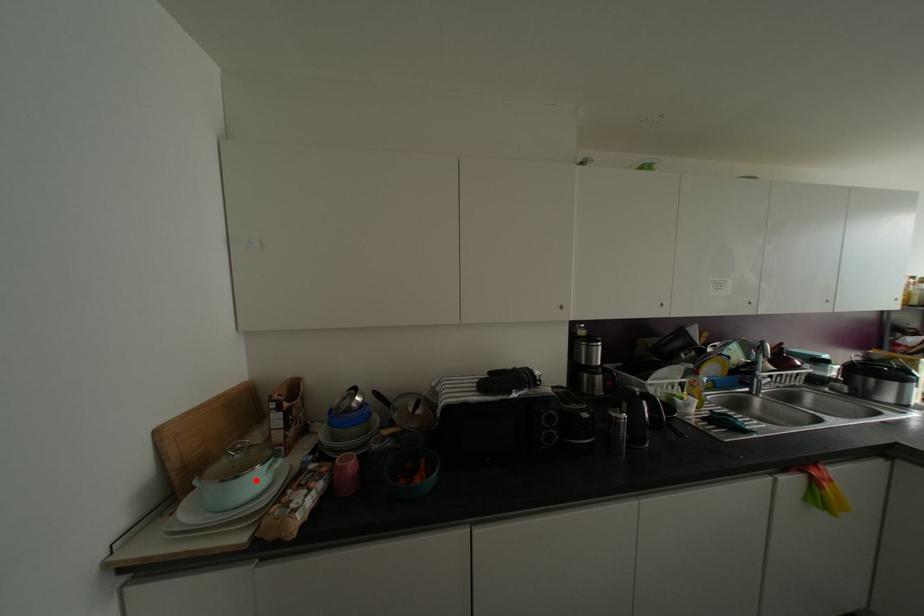
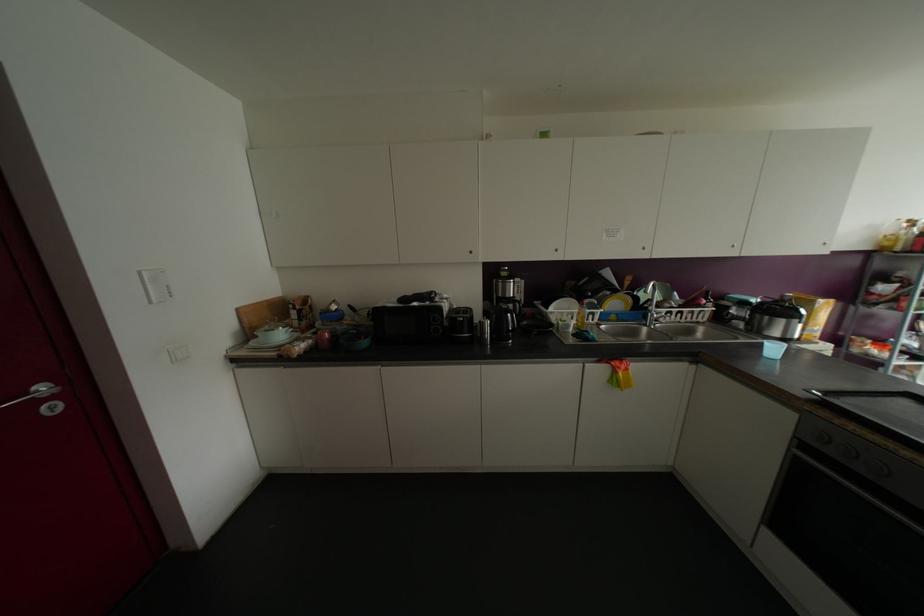
Find the pixel in the second image that matches the highlighted location in the first image.

(281, 334)